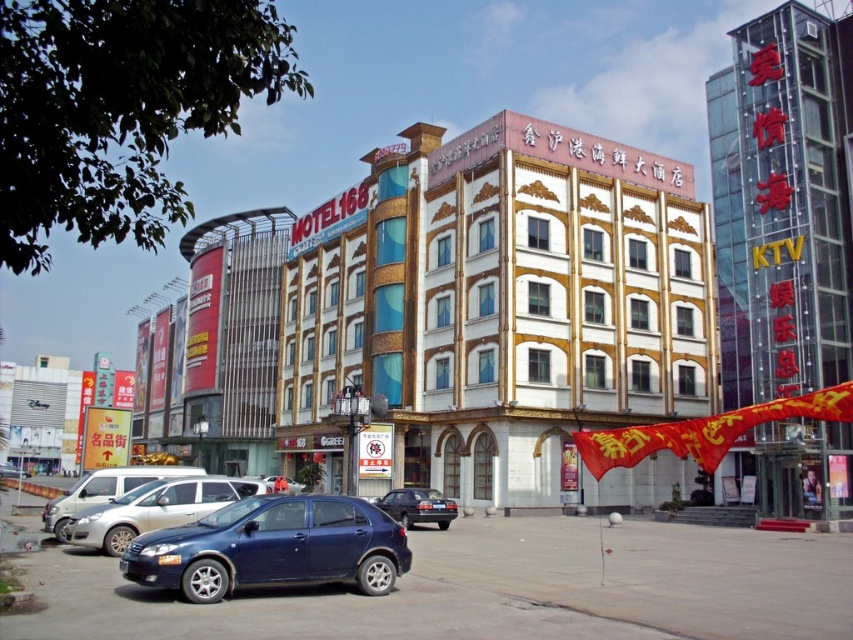
Is point (817, 188) farther from camera compared to point (434, 500)?

No, (817, 188) is in front of (434, 500).

Does point (843, 150) lie in front of point (402, 524)?

That is False.

What are the coordinates of `gold mosaic building at right` in the screenshot? It's located at (782, 204).

Can you confirm if satin blue hatchback at lower left is positioned to the left of metallic silver sedan at lower left?

Incorrect, satin blue hatchback at lower left is not on the left side of metallic silver sedan at lower left.

Who is positioned more to the right, satin blue hatchback at lower left or metallic silver sedan at lower left?

satin blue hatchback at lower left

Does point (218, 541) lie in front of point (137, 481)?

That is True.

What are the coordinates of `satin blue hatchback at lower left` in the screenshot? It's located at (271, 547).

Who is lower down, gold mosaic building at right or satin blue sedan at lower left?

satin blue sedan at lower left is below.

From the picture: Can you confirm if gold mosaic building at right is shorter than satin blue sedan at lower left?

No, gold mosaic building at right is not shorter than satin blue sedan at lower left.

You are a GUI agent. You are given a task and a screenshot of the screen. Output one action in this format:
    pyautogui.click(x=<x>, y=<y>)
    Task: Click on the gold mosaic building at right
    Image resolution: width=853 pixels, height=640 pixels.
    Given the screenshot: What is the action you would take?
    pyautogui.click(x=782, y=204)